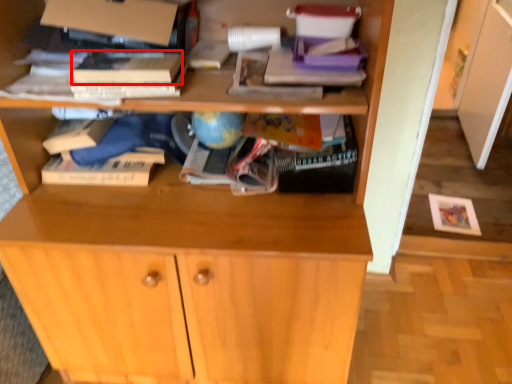
Question: From the image, what is the correct spatial relationship of paperback book (annotated by the red box) in relation to cabinetry?

Choices:
 (A) left
 (B) right

Answer: (A)